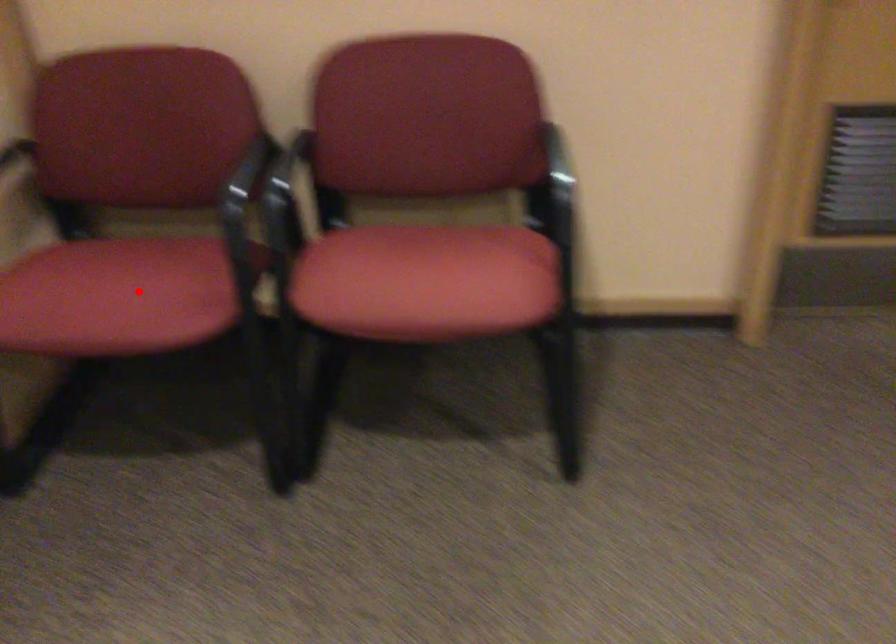
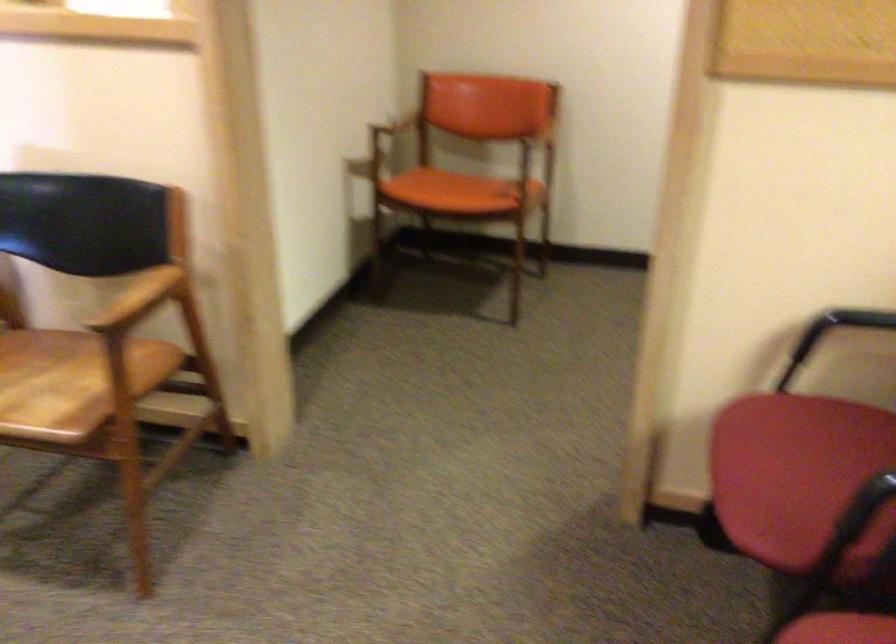
Locate, in the second image, the point that corresponds to the highlighted location in the first image.

(798, 477)